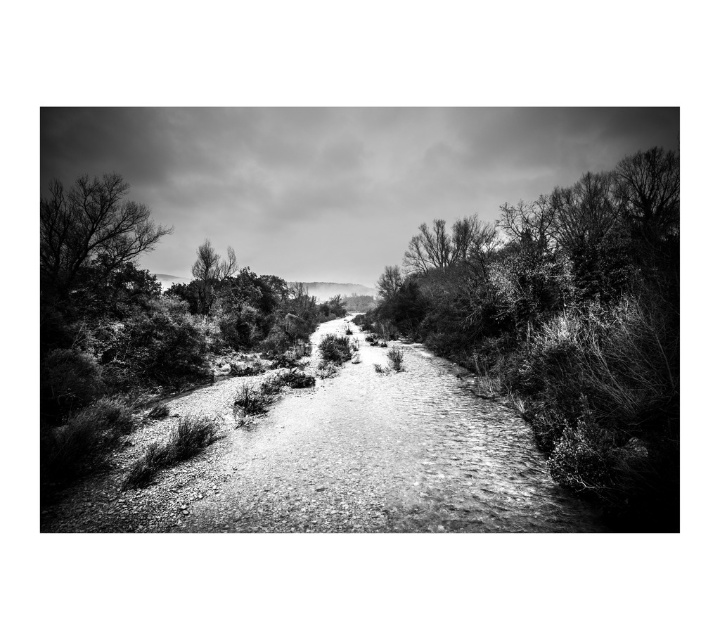
Is point (220, 531) closer to camera compared to point (148, 276)?

Yes.

Does dirt/gravel path at center have a greater width compared to smooth bark tree at upper left?

Correct, the width of dirt/gravel path at center exceeds that of smooth bark tree at upper left.

Image resolution: width=720 pixels, height=640 pixels. What are the coordinates of `dirt/gravel path at center` in the screenshot? It's located at (346, 465).

Does gravelly path at center have a lesser width compared to dirt/gravel path at center?

No.

Is gravelly path at center above dirt/gravel path at center?

Indeed, gravelly path at center is positioned over dirt/gravel path at center.

The height and width of the screenshot is (640, 720). Identify the location of gravelly path at center. (567, 326).

Does gravelly path at center appear under smooth bark tree at upper left?

Correct, gravelly path at center is located below smooth bark tree at upper left.

What do you see at coordinates (567, 326) in the screenshot? The image size is (720, 640). I see `gravelly path at center` at bounding box center [567, 326].

This screenshot has height=640, width=720. What do you see at coordinates (567, 326) in the screenshot?
I see `gravelly path at center` at bounding box center [567, 326].

This screenshot has width=720, height=640. Find the location of `gravelly path at center`. gravelly path at center is located at coordinates (567, 326).